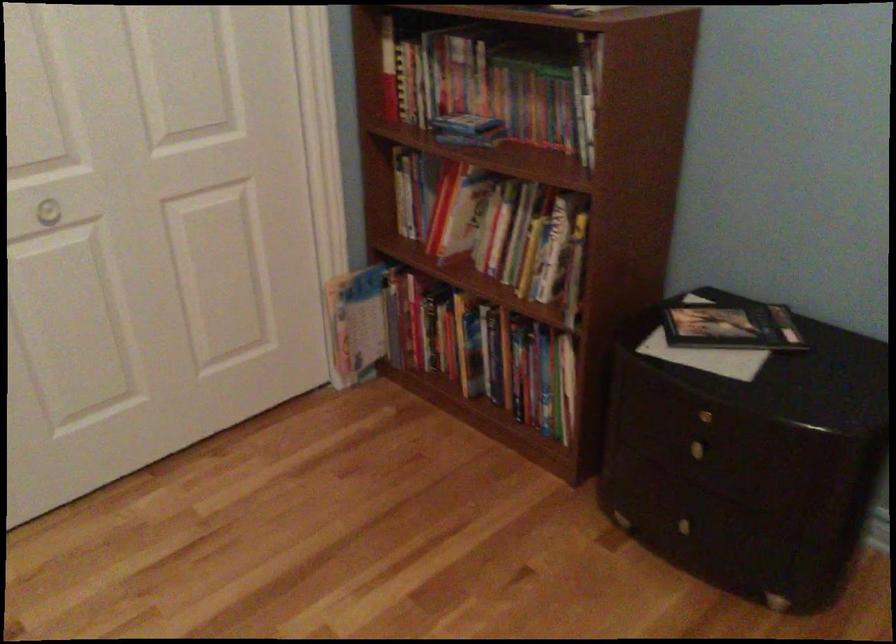
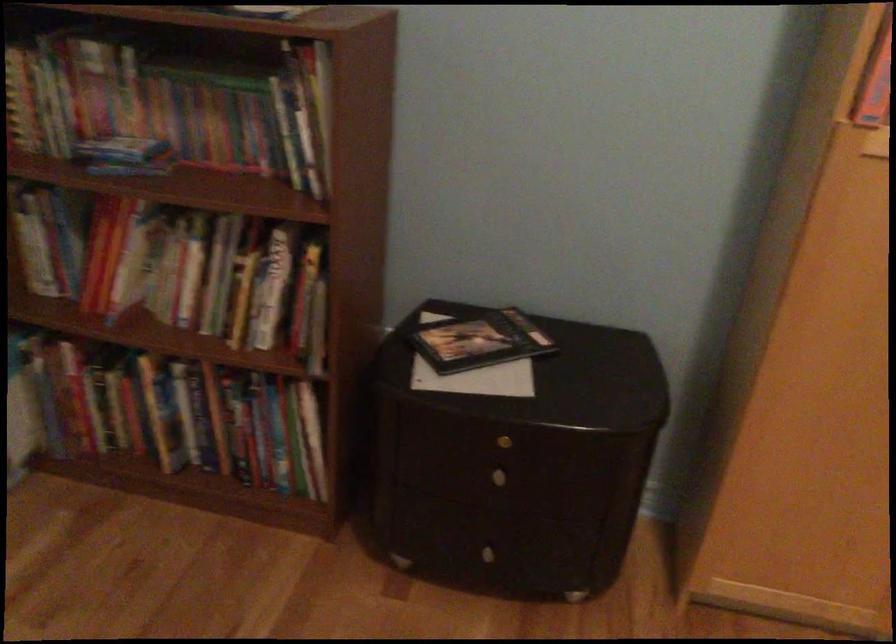
Question: The camera is either moving clockwise (left) or counter-clockwise (right) around the object. The first image is from the beginning of the video and the second image is from the end. Is the camera moving left or right when shooting the video?

Choices:
 (A) Left
 (B) Right

Answer: (A)